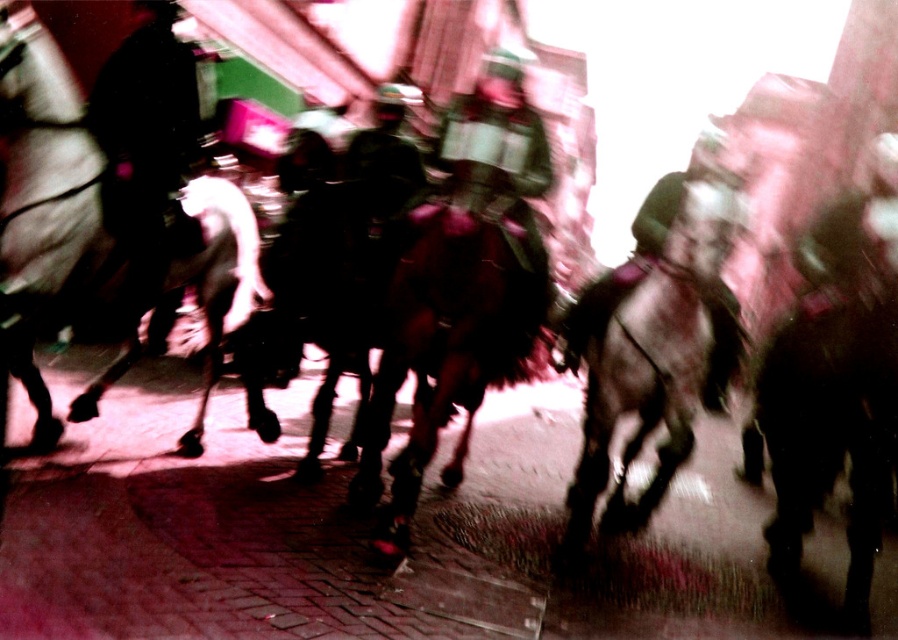
Looking at this image, you are a photographer trying to capture a clear shot of the two points in the scene. Which point is closer to the camera, point(x=14, y=202) or point(x=614, y=401)?

Point(x=14, y=202) is in front of point(x=614, y=401), so it is closer to the camera.

Consider the image. You are a photographer trying to capture a clear photo of both the dark brown fur horse at center and the shiny brown horse at center. Given that your camera can focus on objects within a 3 feet range, will both horses be in focus?

The dark brown fur horse at center is 3.57 feet from the shiny brown horse at center. Since the distance between them is greater than 3 feet, the camera cannot focus on both horses simultaneously, so they won

You need to decide which horse has a wider body between the white glossy horse at left and the dark brown fur at right based on the scene. Which one is wider?

The white glossy horse at left is wider than the dark brown fur at right.